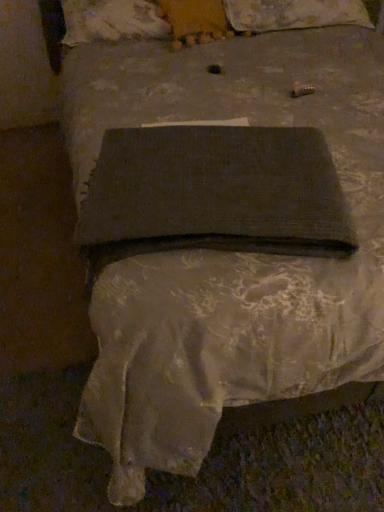
Question: Relative to dark fabric book at center, is fluffy white pillow at upper center, the first pillow viewed from the right, in front or behind?

Choices:
 (A) behind
 (B) front

Answer: (A)

Question: Is fluffy white pillow at upper center, the 2th pillow in the left-to-right sequence, wider or thinner than dark fabric book at center?

Choices:
 (A) thin
 (B) wide

Answer: (B)

Question: Which object is the farthest from the dark fabric book at center?

Choices:
 (A) fluffy beige pillow at upper center, which ranks as the 2th pillow in right-to-left order
 (B) fluffy white pillow at upper center, the 2th pillow in the left-to-right sequence

Answer: (B)

Question: Which is farther from the fluffy beige pillow at upper center, which ranks as the 2th pillow in right-to-left order?

Choices:
 (A) fluffy white pillow at upper center, the 2th pillow in the left-to-right sequence
 (B) dark fabric book at center

Answer: (B)